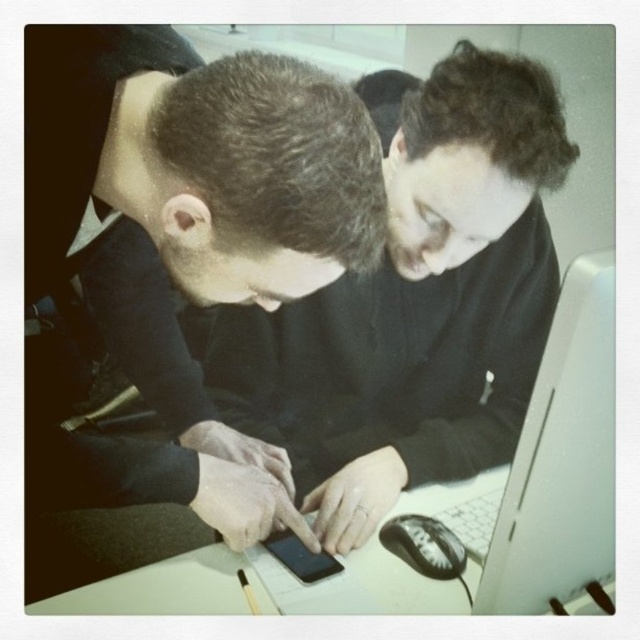
Question: Can you confirm if white glossy monitor at right is bigger than white plastic keyboard at lower right?

Choices:
 (A) yes
 (B) no

Answer: (A)

Question: Estimate the real-world distances between objects in this image. Which object is farther from the white plastic keyboard at lower right?

Choices:
 (A) black glossy phone at center
 (B) black plastic mouse at lower center

Answer: (A)

Question: Is matte black phone at center smaller than black plastic mouse at lower center?

Choices:
 (A) yes
 (B) no

Answer: (B)

Question: Which is nearer to the black plastic mouse at lower center?

Choices:
 (A) black glossy phone at center
 (B) matte black phone at center
 (C) white glossy monitor at right
 (D) white glossy laptop at center

Answer: (A)

Question: Does white glossy laptop at center lie in front of white plastic keyboard at lower right?

Choices:
 (A) no
 (B) yes

Answer: (B)

Question: Which point appears farthest from the camera in this image?

Choices:
 (A) (275, 534)
 (B) (561, 449)
 (C) (273, 230)

Answer: (A)